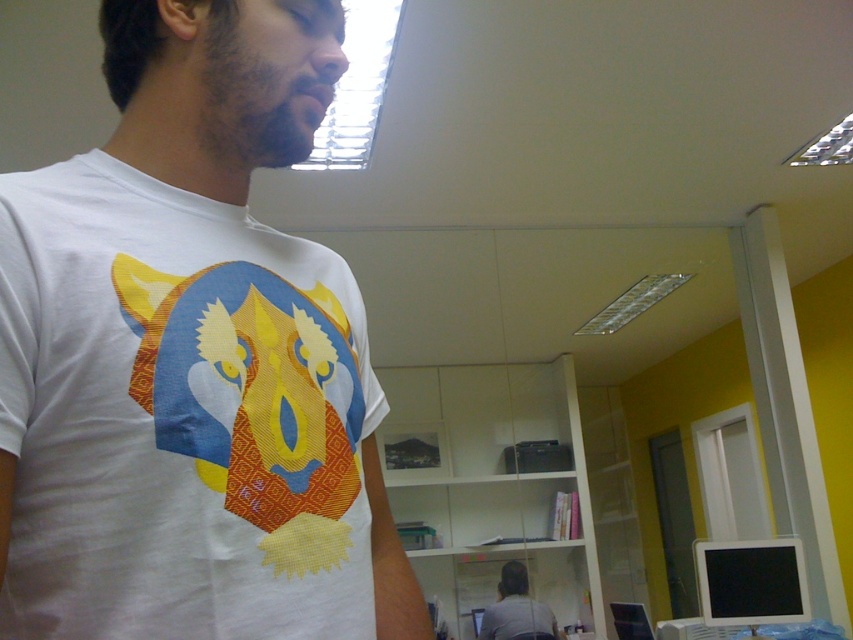
Question: Among these objects, which one is nearest to the camera?

Choices:
 (A) white matte t-shirt at center
 (B) white t-shirt at center

Answer: (A)

Question: Which of the following is the closest to the observer?

Choices:
 (A) white t-shirt at center
 (B) white matte t-shirt at center

Answer: (B)

Question: Is white matte t-shirt at center to the right of white t-shirt at center from the viewer's perspective?

Choices:
 (A) no
 (B) yes

Answer: (A)

Question: Does white matte t-shirt at center lie in front of white t-shirt at center?

Choices:
 (A) no
 (B) yes

Answer: (B)

Question: Is the position of white matte t-shirt at center more distant than that of white t-shirt at center?

Choices:
 (A) yes
 (B) no

Answer: (B)